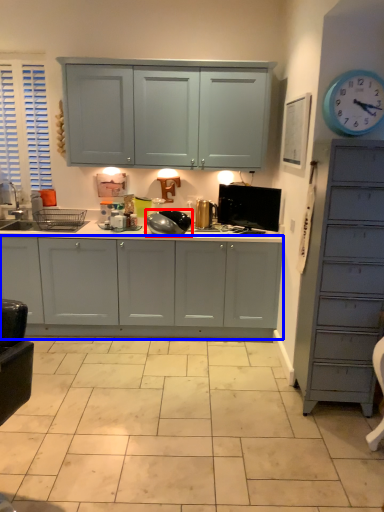
Question: Which object is closer to the camera taking this photo, appliance (highlighted by a red box) or cabinetry (highlighted by a blue box)?

Choices:
 (A) appliance
 (B) cabinetry

Answer: (B)